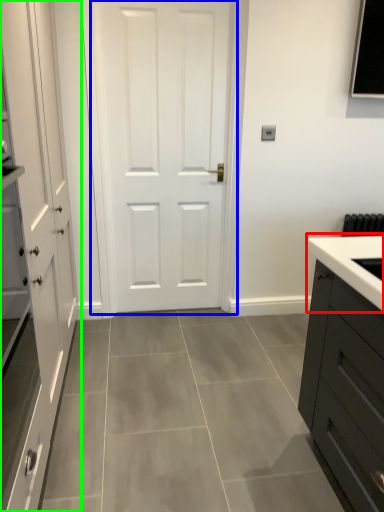
Question: Based on their relative distances, which object is nearer to sink (highlighted by a red box)? Choose from door (highlighted by a blue box) and cabinetry (highlighted by a green box).

Choices:
 (A) door
 (B) cabinetry

Answer: (B)